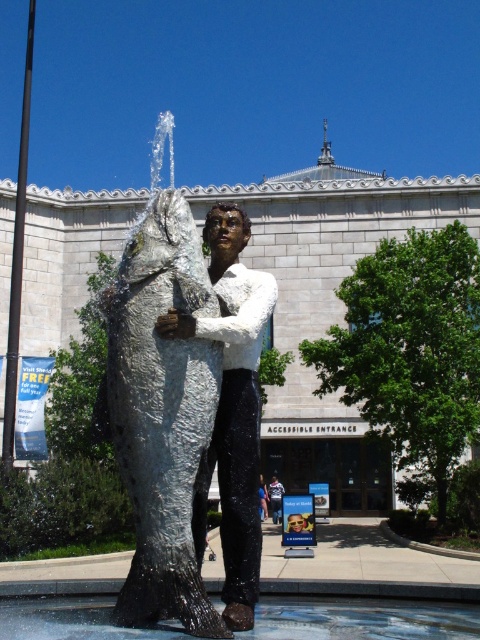
Which is in front, point (260, 637) or point (280, 506)?

Point (260, 637) is more forward.

Which of these two, clear water at fountain center or metallic statue at center, stands taller?

metallic statue at center is taller.

Between point (264, 625) and point (280, 493), which one is positioned in front?

Point (264, 625) is more forward.

You are a GUI agent. You are given a task and a screenshot of the screen. Output one action in this format:
    pyautogui.click(x=<x>, y=<y>)
    Task: Click on the clear water at fountain center
    This screenshot has height=640, width=480.
    Given the screenshot: What is the action you would take?
    pyautogui.click(x=361, y=620)

Is point (249, 589) closer to viewer compared to point (396, 609)?

Yes, it is in front of point (396, 609).

Locate an element on the screen. Image resolution: width=480 pixels, height=640 pixels. shiny silver statue at center is located at coordinates click(x=231, y=406).

Where is `shiny silver statue at center`? shiny silver statue at center is located at coordinates (231, 406).

Can you confirm if shiny metallic fish at center is positioned above shiny silver statue at center?

Yes.

Between shiny metallic fish at center and shiny silver statue at center, which one has less height?

shiny silver statue at center

Who is more forward, (181, 305) or (225, 515)?

Point (181, 305)

Where is `shiny metallic fish at center`? The width and height of the screenshot is (480, 640). shiny metallic fish at center is located at coordinates (160, 412).